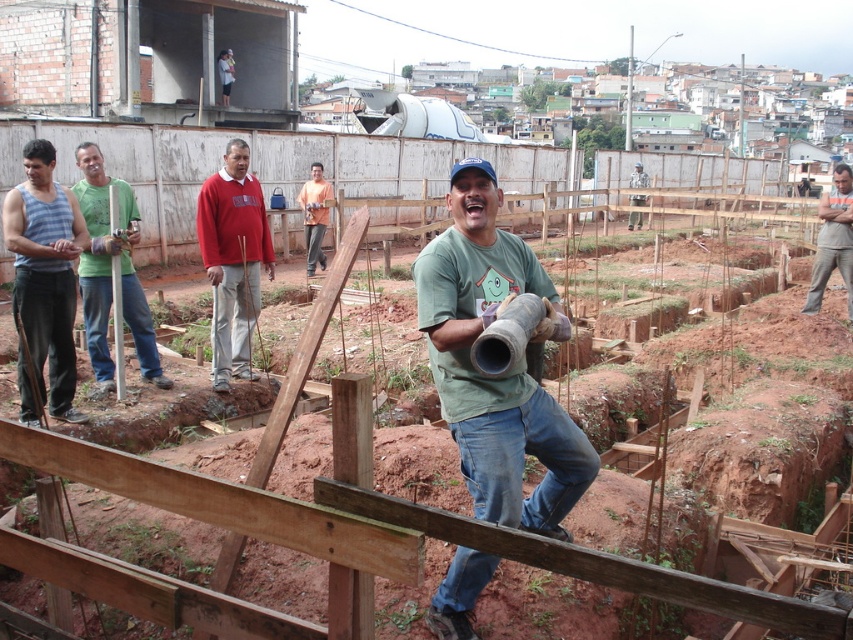
Question: Is green matte shirt at center positioned before striped tank top at left?

Choices:
 (A) yes
 (B) no

Answer: (A)

Question: Which of the following is the farthest from the observer?

Choices:
 (A) green matte shirt at left
 (B) red sweater at center
 (C) orange fabric shirt at center

Answer: (C)

Question: Is red sweater at center bigger than brown cotton pants at center?

Choices:
 (A) yes
 (B) no

Answer: (B)

Question: Which point appears farthest from the camera in this image?

Choices:
 (A) (526, 520)
 (B) (77, 218)
 (C) (163, 387)

Answer: (C)

Question: Which object appears farthest from the camera in this image?

Choices:
 (A) orange fabric shirt at center
 (B) red sweater at center
 (C) brown cotton pants at center
 (D) green matte shirt at center

Answer: (A)

Question: Can you confirm if striped tank top at left is positioned to the right of orange fabric shirt at center?

Choices:
 (A) no
 (B) yes

Answer: (A)